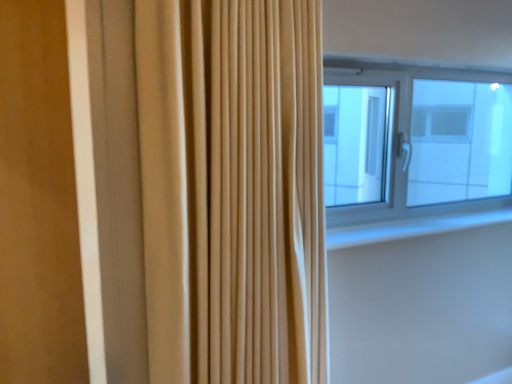
Question: Can you confirm if white smooth window sill at upper right is smaller than transparent glass window at upper right?

Choices:
 (A) no
 (B) yes

Answer: (B)

Question: Does white smooth window sill at upper right come in front of transparent glass window at upper right?

Choices:
 (A) no
 (B) yes

Answer: (B)

Question: Is white smooth window sill at upper right further to camera compared to transparent glass window at upper right?

Choices:
 (A) yes
 (B) no

Answer: (B)

Question: Would you consider white smooth window sill at upper right to be distant from transparent glass window at upper right?

Choices:
 (A) no
 (B) yes

Answer: (B)

Question: Can you confirm if white smooth window sill at upper right is shorter than transparent glass window at upper right?

Choices:
 (A) no
 (B) yes

Answer: (B)

Question: Does white smooth window sill at upper right have a greater height compared to transparent glass window at upper right?

Choices:
 (A) yes
 (B) no

Answer: (B)

Question: Are transparent glass window at upper right and beige fabric curtain at center making contact?

Choices:
 (A) yes
 (B) no

Answer: (B)

Question: From the image's perspective, is transparent glass window at upper right beneath beige fabric curtain at center?

Choices:
 (A) yes
 (B) no

Answer: (B)

Question: Considering the relative sizes of transparent glass window at upper right and beige fabric curtain at center in the image provided, is transparent glass window at upper right thinner than beige fabric curtain at center?

Choices:
 (A) no
 (B) yes

Answer: (B)

Question: Considering the relative sizes of transparent glass window at upper right and beige fabric curtain at center in the image provided, is transparent glass window at upper right taller than beige fabric curtain at center?

Choices:
 (A) yes
 (B) no

Answer: (B)

Question: Considering the relative positions of transparent glass window at upper right and beige fabric curtain at center in the image provided, is transparent glass window at upper right to the right of beige fabric curtain at center from the viewer's perspective?

Choices:
 (A) yes
 (B) no

Answer: (A)

Question: Is transparent glass window at upper right positioned in front of beige fabric curtain at center?

Choices:
 (A) yes
 (B) no

Answer: (B)

Question: Can you confirm if white smooth window sill at upper right is thinner than beige fabric curtain at center?

Choices:
 (A) yes
 (B) no

Answer: (A)